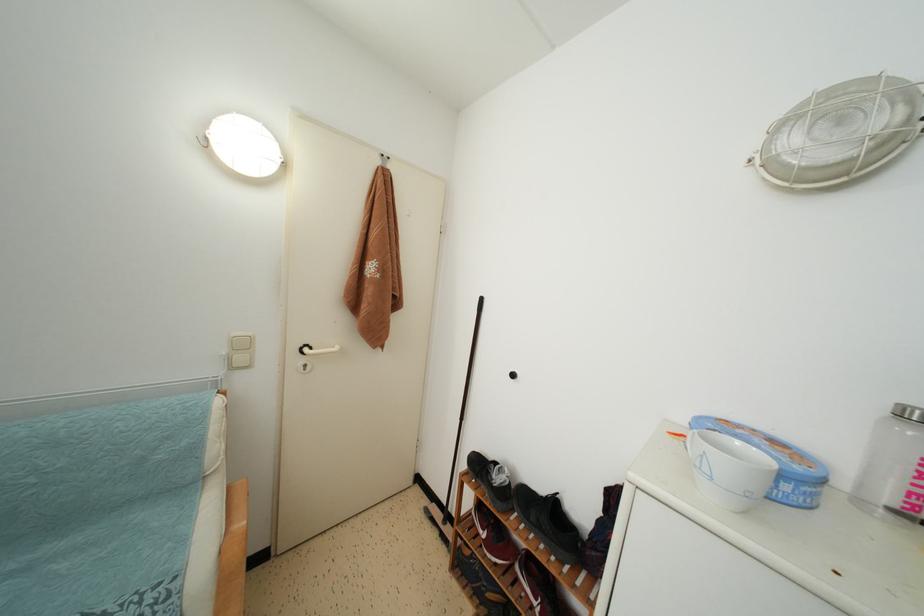
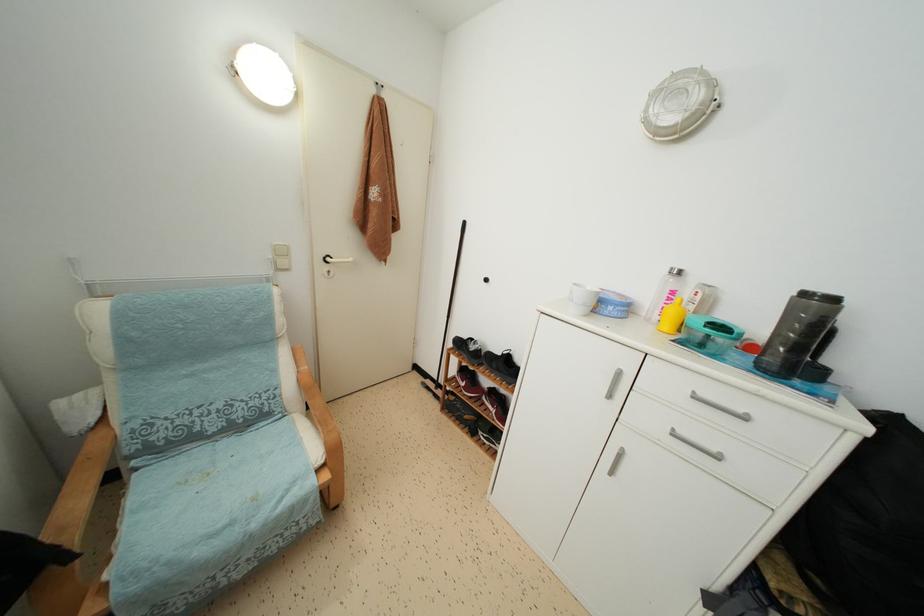
The point at (537, 525) is marked in the first image. Where is the corresponding point in the second image?

(497, 371)